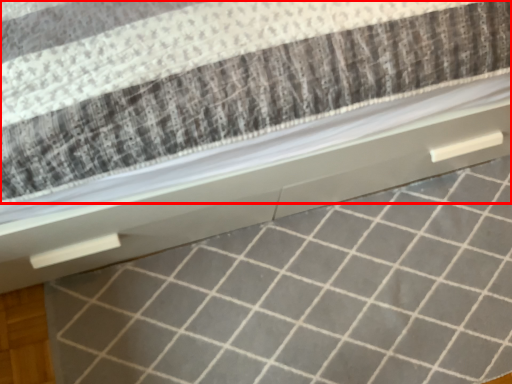
Question: Observing the image, what is the correct spatial positioning of mattress (annotated by the red box) in reference to tile?

Choices:
 (A) right
 (B) left

Answer: (B)